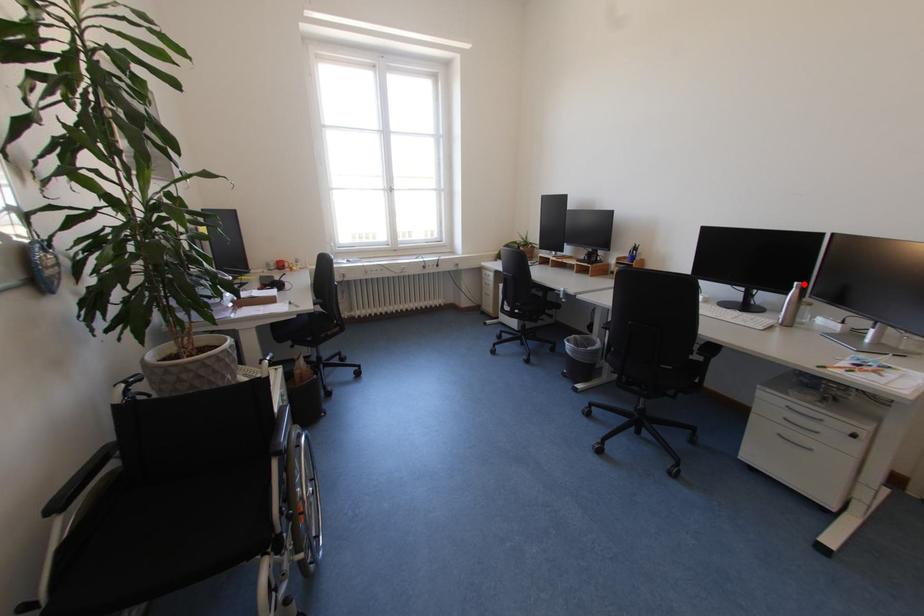
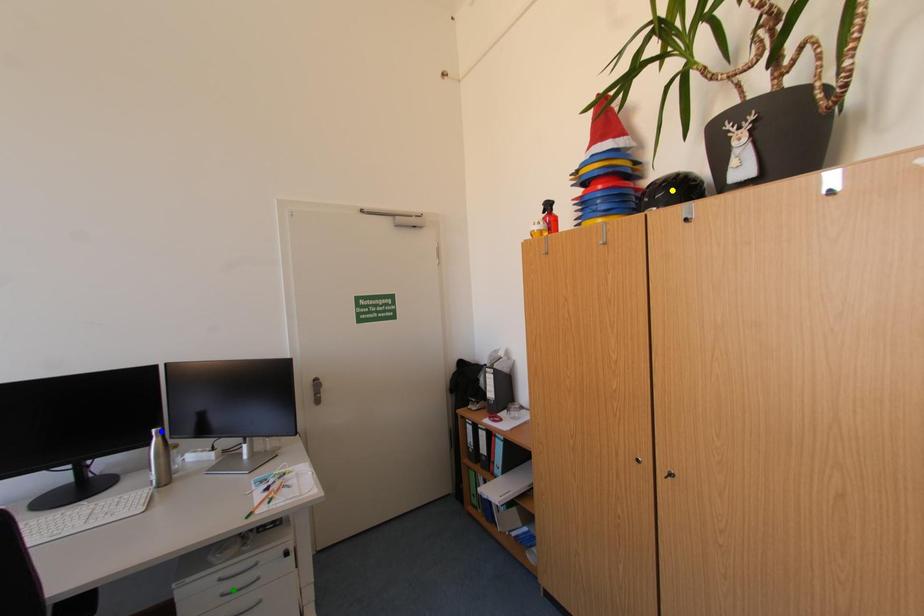
Question: I am providing you with two images of the same scene from different viewpoints. A red point is marked on the first image. You are given multiple points on the second image. Which point in image 2 represents the same 3d spot as the red point in image 1?

Choices:
 (A) blue point
 (B) green point
 (C) yellow point

Answer: (A)